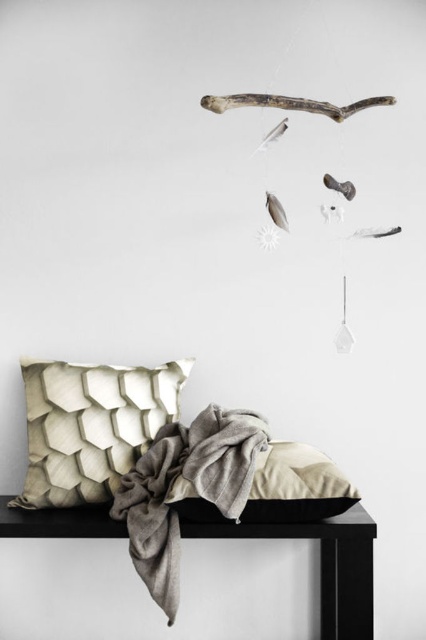
Is beige textured pillow at lower left bigger than black matte table at center?

Incorrect, beige textured pillow at lower left is not larger than black matte table at center.

Is point (173, 394) closer to camera compared to point (348, 531)?

No, (173, 394) is behind (348, 531).

Locate an element on the screen. beige textured pillow at lower left is located at coordinates (91, 426).

What do you see at coordinates (91, 426) in the screenshot?
I see `beige textured pillow at lower left` at bounding box center [91, 426].

Does beige textured pillow at lower left have a smaller size compared to soft beige blanket at center?

Indeed, beige textured pillow at lower left has a smaller size compared to soft beige blanket at center.

The height and width of the screenshot is (640, 426). Describe the element at coordinates (91, 426) in the screenshot. I see `beige textured pillow at lower left` at that location.

At what (x,y) coordinates should I click in order to perform the action: click on beige textured pillow at lower left. Please return your answer as a coordinate pair (x, y). Looking at the image, I should click on (91, 426).

Can you confirm if soft beige blanket at center is shorter than black matte table at center?

In fact, soft beige blanket at center may be taller than black matte table at center.

Is soft beige blanket at center smaller than black matte table at center?

Yes.

Which is in front, point (152, 582) or point (322, 586)?

Point (152, 582) is more forward.

Identify the location of soft beige blanket at center. (192, 484).